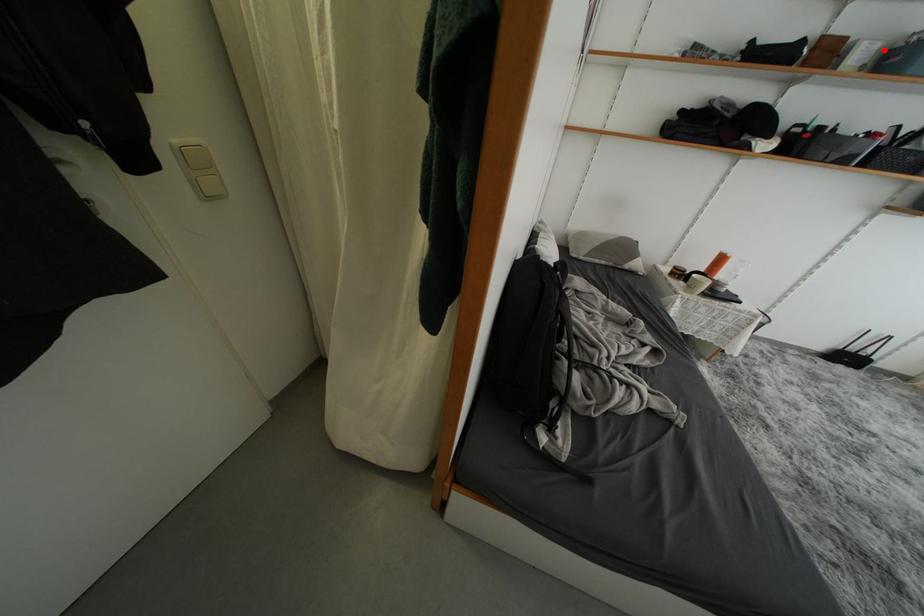
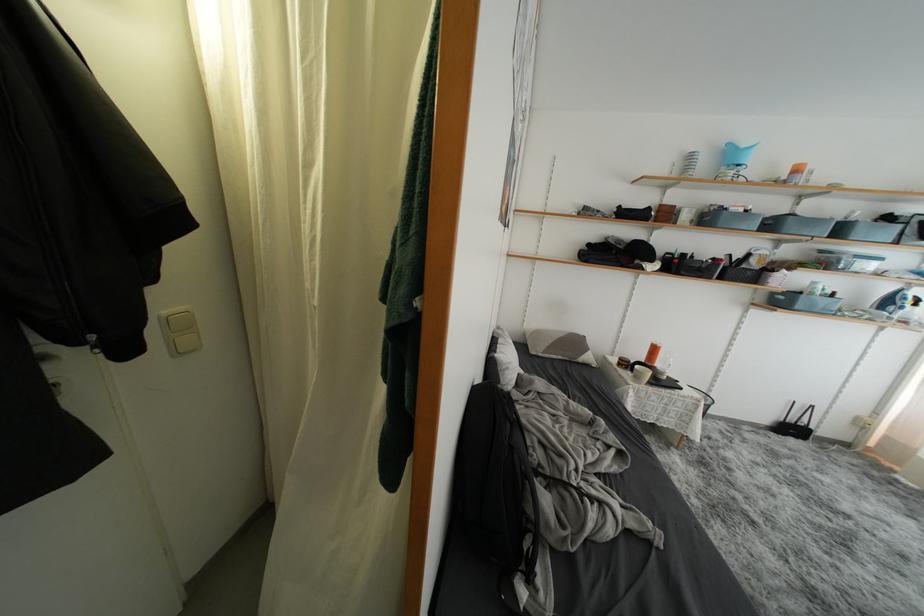
Where in the second image is the point corresponding to the highlighted location from the first image?

(700, 215)